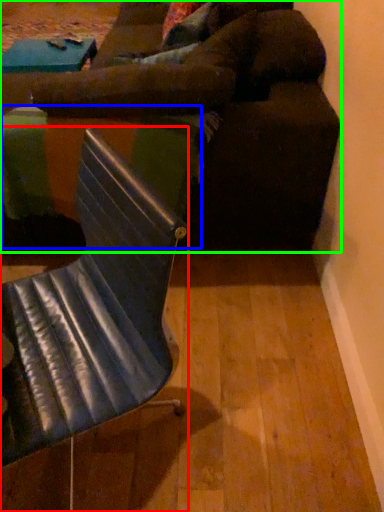
Question: Which is farther away from chair (highlighted by a red box)? table (highlighted by a blue box) or studio couch (highlighted by a green box)?

Choices:
 (A) table
 (B) studio couch

Answer: (B)